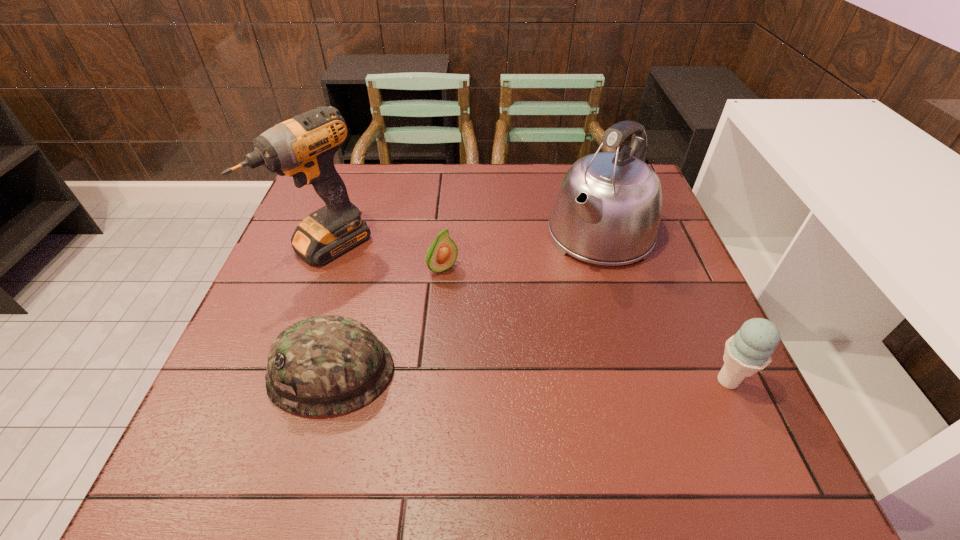
At what (x,y) coordinates should I click in order to perform the action: click on free spot located 0.050m on the cut side of the avocado. Please return your answer as a coordinate pair (x, y). The height and width of the screenshot is (540, 960). Looking at the image, I should click on 464,289.

The width and height of the screenshot is (960, 540). What are the coordinates of `free point located on the cut side of the avocado` in the screenshot? It's located at (471, 296).

In order to click on vacant space located on the cut side of the avocado in this screenshot , I will do `click(550, 377)`.

The image size is (960, 540). Identify the location of vacant space located with the drill bit of the drill facing forward. (454, 345).

You are a GUI agent. You are given a task and a screenshot of the screen. Output one action in this format:
    pyautogui.click(x=<x>, y=<y>)
    Task: Click on the free space located 0.270m with the drill bit of the drill facing forward
    The height and width of the screenshot is (540, 960).
    Given the screenshot: What is the action you would take?
    pyautogui.click(x=430, y=327)

This screenshot has width=960, height=540. Find the location of `vacant space located with the drill bit of the drill facing forward`. vacant space located with the drill bit of the drill facing forward is located at coordinates (475, 361).

Image resolution: width=960 pixels, height=540 pixels. What are the coordinates of `object present at the far edge` in the screenshot? It's located at (607, 210).

Where is `headwear that is positioned at the near edge`? headwear that is positioned at the near edge is located at coordinates (326, 365).

Where is `ice cream present at the near edge`? This screenshot has height=540, width=960. ice cream present at the near edge is located at coordinates (748, 351).

What are the coordinates of `headwear that is positioned at the left edge` in the screenshot? It's located at (326, 365).